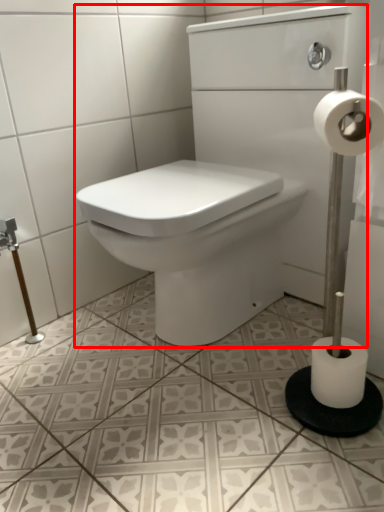
Question: Considering the relative positions of sink (annotated by the red box) and toilet paper in the image provided, where is sink (annotated by the red box) located with respect to the staircase?

Choices:
 (A) right
 (B) left

Answer: (B)